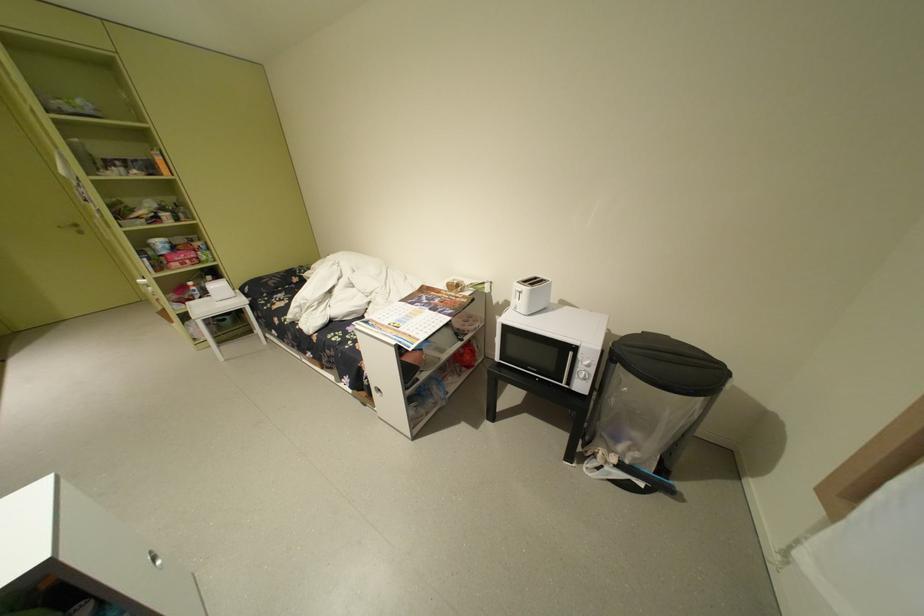
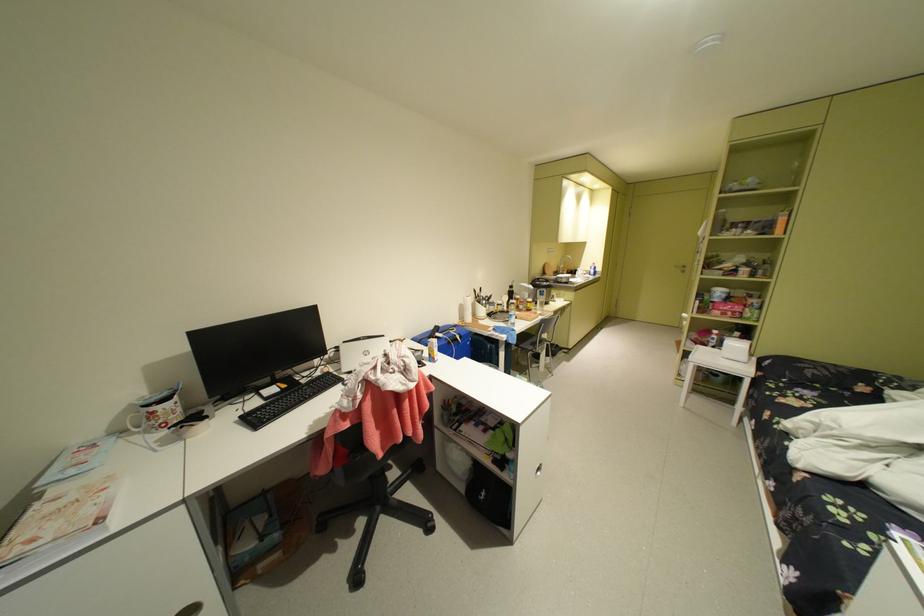
How did the camera likely rotate?

The camera rotated toward left-down.